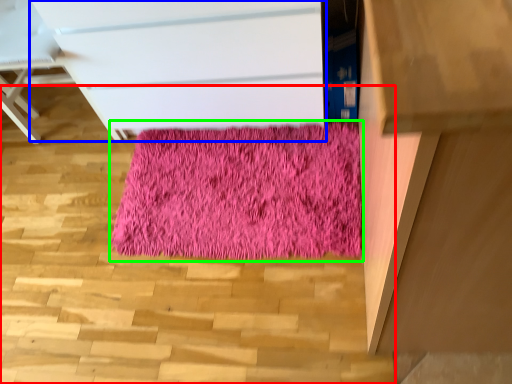
Question: Which object is positioned farthest from stairwell (highlighted by a red box)? Select from chest of drawers (highlighted by a blue box) and mat (highlighted by a green box).

Choices:
 (A) chest of drawers
 (B) mat

Answer: (A)